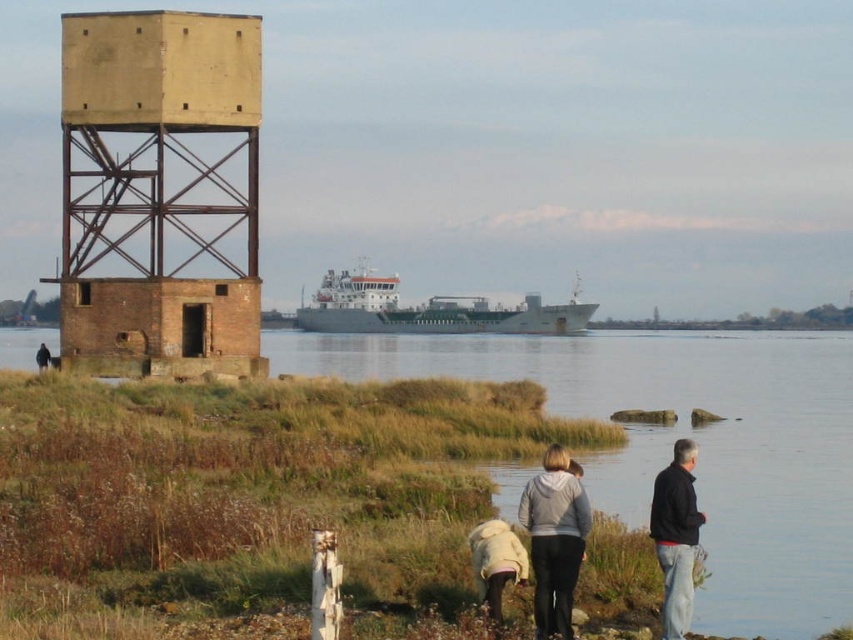
You are standing at the riverside and see the yellowish concrete observation tower at left and the gray matte cargo ship at center. Which object is positioned further to the left?

The yellowish concrete observation tower at left is positioned further to the left than the gray matte cargo ship at center.

From the picture: You are trying to decide which jacket to wear for a hike. Both jackets are in your view. The dark blue jacket at lower right and the white fleece jacket at lower center. Which jacket is taller?

The dark blue jacket at lower right is taller than the white fleece jacket at lower center.